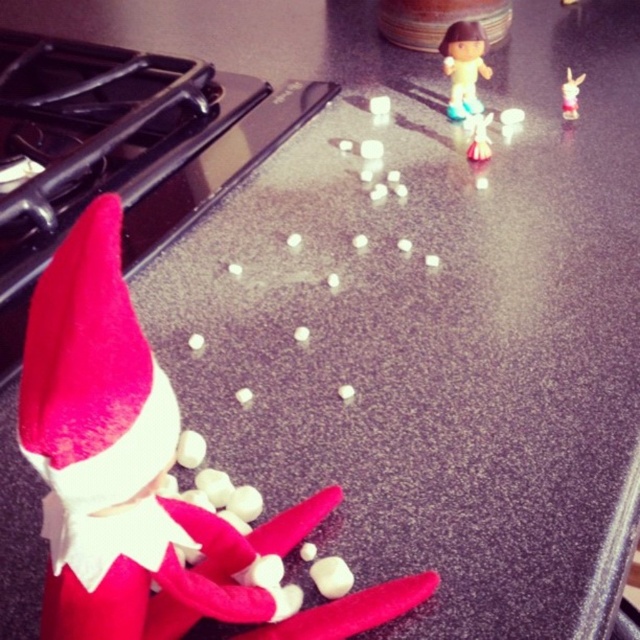
Question: Is felt red elf at lower left wider than smooth plastic doll at upper center?

Choices:
 (A) no
 (B) yes

Answer: (B)

Question: Can you confirm if felt red elf at lower left is positioned below smooth plastic doll at upper center?

Choices:
 (A) yes
 (B) no

Answer: (A)

Question: Which object appears closest to the camera in this image?

Choices:
 (A) smooth plastic doll at upper center
 (B) matte plastic figurine at upper center

Answer: (B)

Question: Does smooth plastic doll at upper center have a lesser width compared to white glossy rabbit at upper right?

Choices:
 (A) yes
 (B) no

Answer: (B)

Question: Which point is farther from the camera taking this photo?

Choices:
 (A) (452, 100)
 (B) (484, 140)

Answer: (A)

Question: Which point appears closest to the camera in this image?

Choices:
 (A) (577, 84)
 (B) (442, 56)
 (C) (483, 132)

Answer: (C)